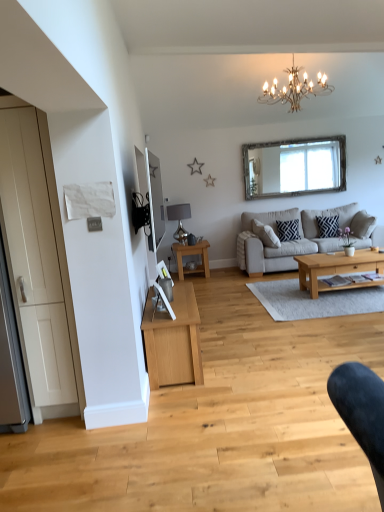
Where is `gold metallic chandelier at upper center`? This screenshot has height=512, width=384. gold metallic chandelier at upper center is located at coordinates (294, 89).

The image size is (384, 512). I want to click on dark blue textured pillow at center right, acting as the 1th pillow starting from the right, so click(328, 226).

Consider the image. In order to face dark blue textured pillow at center right, acting as the 1th pillow starting from the right, should I rotate leftwards or rightwards?

Rotate your view right by about 17.892°.

Measure the distance between point (x=279, y=226) and camera.

Point (x=279, y=226) is 6.81 meters from camera.

The height and width of the screenshot is (512, 384). Describe the element at coordinates (38, 261) in the screenshot. I see `white matte door at left` at that location.

Locate an element on the screen. Image resolution: width=384 pixels, height=512 pixels. matte silver lamp at center-left is located at coordinates (179, 220).

Could you tell me if dark blue textured pillow at center right, which ranks as the second pillow in left-to-right order, is facing white matte door at left?

No, dark blue textured pillow at center right, which ranks as the second pillow in left-to-right order, does not turn towards white matte door at left.

Where is `door above the dark blue textured pillow at center right, acting as the 1th pillow starting from the right (from a real-world perspective)`? door above the dark blue textured pillow at center right, acting as the 1th pillow starting from the right (from a real-world perspective) is located at coordinates (38, 261).

Can you confirm if dark blue textured pillow at center right, acting as the 1th pillow starting from the right, is positioned to the right of white matte door at left?

Indeed, dark blue textured pillow at center right, acting as the 1th pillow starting from the right, is positioned on the right side of white matte door at left.

Is dark blue textured pillow at center right, acting as the 1th pillow starting from the right, wider than white matte door at left?

No.

Is the position of matte black mirror at upper left, which is the 2th mirror in back-to-front order, more distant than that of gold metallic chandelier at upper center?

No, it is in front of gold metallic chandelier at upper center.

The height and width of the screenshot is (512, 384). Find the location of `light fixture behind the matte black mirror at upper left, the first mirror positioned from the left`. light fixture behind the matte black mirror at upper left, the first mirror positioned from the left is located at coordinates (294, 89).

What's the angular difference between matte black mirror at upper left, which is the 2th mirror in back-to-front order, and gold metallic chandelier at upper center's facing directions?

There is a 86.8-degree angle between the facing directions of matte black mirror at upper left, which is the 2th mirror in back-to-front order, and gold metallic chandelier at upper center.

From a real-world perspective, does matte black mirror at upper left, acting as the 2th mirror starting from the right, sit lower than gold metallic chandelier at upper center?

Yes.

Between point (277, 224) and point (273, 83), which one is positioned behind?

Point (277, 224)

Is dark blue geometric-patterned pillow at center, the 1th pillow in the left-to-right sequence, at the right side of gold metallic chandelier at upper center?

Correct, you'll find dark blue geometric-patterned pillow at center, the 1th pillow in the left-to-right sequence, to the right of gold metallic chandelier at upper center.

Considering their positions, is dark blue geometric-patterned pillow at center, the second pillow viewed from the right, located in front of or behind gold metallic chandelier at upper center?

Clearly, dark blue geometric-patterned pillow at center, the second pillow viewed from the right, is behind gold metallic chandelier at upper center.

Is dark blue geometric-patterned pillow at center, the 1th pillow in the left-to-right sequence, aimed at gold metallic chandelier at upper center?

No.

From a real-world perspective, is silver-framed mirror at upper center, the first mirror positioned from the right, below dark blue textured pillow at center right, which ranks as the second pillow in left-to-right order?

No, from a real-world perspective, silver-framed mirror at upper center, the first mirror positioned from the right, is not beneath dark blue textured pillow at center right, which ranks as the second pillow in left-to-right order.

From the image's perspective, which one is positioned lower, silver-framed mirror at upper center, marked as the 1th mirror in a back-to-front arrangement, or dark blue textured pillow at center right, acting as the 1th pillow starting from the right?

From the image's view, dark blue textured pillow at center right, acting as the 1th pillow starting from the right, is below.

Does silver-framed mirror at upper center, which appears as the second mirror when viewed from the front, have a larger size compared to dark blue textured pillow at center right, acting as the 1th pillow starting from the right?

Yes.

Is silver-framed mirror at upper center, the second mirror viewed from the left, smaller than light gray fabric couch at center?

Correct, silver-framed mirror at upper center, the second mirror viewed from the left, occupies less space than light gray fabric couch at center.

Is silver-framed mirror at upper center, the 2th mirror when ordered from bottom to top, facing away from light gray fabric couch at center?

That's not correct — silver-framed mirror at upper center, the 2th mirror when ordered from bottom to top, is not looking away from light gray fabric couch at center.

What's the angular difference between silver-framed mirror at upper center, the first mirror positioned from the right, and light gray fabric couch at center's facing directions?

The facing directions of silver-framed mirror at upper center, the first mirror positioned from the right, and light gray fabric couch at center are 0.168 degrees apart.

Is point (337, 236) closer to viewer compared to point (309, 267)?

No, (337, 236) is behind (309, 267).

Is dark blue textured pillow at center right, acting as the 1th pillow starting from the right, spatially inside light brown wooden coffee table at center, the 2th coffee table viewed from the left, or outside of it?

dark blue textured pillow at center right, acting as the 1th pillow starting from the right, is not enclosed by light brown wooden coffee table at center, the 2th coffee table viewed from the left.

Is dark blue textured pillow at center right, acting as the 1th pillow starting from the right, not close to light brown wooden coffee table at center, which appears as the first coffee table when viewed from the right?

Yes, dark blue textured pillow at center right, acting as the 1th pillow starting from the right, and light brown wooden coffee table at center, which appears as the first coffee table when viewed from the right, are located far from each other.

From the image's perspective, is dark blue textured pillow at center right, acting as the 1th pillow starting from the right, on light brown wooden coffee table at center, arranged as the 2th coffee table when viewed from the back?

Yes, from the image's perspective, dark blue textured pillow at center right, acting as the 1th pillow starting from the right, is above light brown wooden coffee table at center, arranged as the 2th coffee table when viewed from the back.

Is light brown wooden coffee table at center, arranged as the 2th coffee table when viewed from the back, wider than gold metallic chandelier at upper center?

Incorrect, the width of light brown wooden coffee table at center, arranged as the 2th coffee table when viewed from the back, does not surpass that of gold metallic chandelier at upper center.

Can you confirm if light brown wooden coffee table at center, arranged as the 2th coffee table when viewed from the back, is shorter than gold metallic chandelier at upper center?

Indeed, light brown wooden coffee table at center, arranged as the 2th coffee table when viewed from the back, has a lesser height compared to gold metallic chandelier at upper center.

Does light brown wooden coffee table at center, the 2th coffee table viewed from the left, appear on the right side of gold metallic chandelier at upper center?

Yes, light brown wooden coffee table at center, the 2th coffee table viewed from the left, is to the right of gold metallic chandelier at upper center.

Is light brown wooden coffee table at center, which appears as the first coffee table when viewed from the right, aimed at gold metallic chandelier at upper center?

No.

From a real-world perspective, starting from the white matte door at left, which pillow is the 2nd one below it? Please provide its 2D coordinates.

[(328, 226)]

In order to click on mirror on the left side of gold metallic chandelier at upper center in this screenshot , I will do (154, 210).

Considering their positions, is light wood/texture coffee table at center, the first coffee table in the left-to-right sequence, positioned closer to light gray fabric couch at center than gold metallic chandelier at upper center?

light wood/texture coffee table at center, the first coffee table in the left-to-right sequence, is closer to light gray fabric couch at center.

Which object lies nearer to the anchor point matte silver lamp at center-left, dark blue geometric-patterned pillow at center, the second pillow viewed from the right, or light wood/texture coffee table at center, the 2th coffee table in the right-to-left sequence?

Based on the image, light wood/texture coffee table at center, the 2th coffee table in the right-to-left sequence, appears to be nearer to matte silver lamp at center-left.

Which object lies nearer to the anchor point white matte door at left, matte black mirror at upper left, acting as the 2th mirror starting from the right, or gold metallic chandelier at upper center?

The object closer to white matte door at left is matte black mirror at upper left, acting as the 2th mirror starting from the right.

Estimate the real-world distances between objects in this image. Which object is further from dark blue textured pillow at center right, acting as the 1th pillow starting from the right, light gray fabric couch at center or matte silver lamp at center-left?

Based on the image, matte silver lamp at center-left appears to be further to dark blue textured pillow at center right, acting as the 1th pillow starting from the right.

Considering their positions, is light brown wooden coffee table at center, the 2th coffee table viewed from the left, positioned further to white matte door at left than dark blue textured pillow at center right, which ranks as the second pillow in left-to-right order?

dark blue textured pillow at center right, which ranks as the second pillow in left-to-right order, is positioned further to the anchor white matte door at left.

Estimate the real-world distances between objects in this image. Which object is closer to light brown wooden coffee table at center, which ranks as the first coffee table in front-to-back order, gold metallic chandelier at upper center or dark blue textured pillow at center right, acting as the 1th pillow starting from the right?

The object closer to light brown wooden coffee table at center, which ranks as the first coffee table in front-to-back order, is dark blue textured pillow at center right, acting as the 1th pillow starting from the right.

Estimate the real-world distances between objects in this image. Which object is closer to gold metallic chandelier at upper center, silver-framed mirror at upper center, marked as the 1th mirror in a back-to-front arrangement, or light wood/texture coffee table at center, the 2th coffee table in the right-to-left sequence?

The object closer to gold metallic chandelier at upper center is silver-framed mirror at upper center, marked as the 1th mirror in a back-to-front arrangement.

When comparing their distances from light gray fabric couch at center, does light brown wooden coffee table at center, which ranks as the first coffee table in front-to-back order, or dark blue geometric-patterned pillow at center, the 1th pillow in the left-to-right sequence, seem closer?

Based on the image, dark blue geometric-patterned pillow at center, the 1th pillow in the left-to-right sequence, appears to be nearer to light gray fabric couch at center.

I want to click on light fixture positioned between white matte door at left and light wood/texture coffee table at center, the first coffee table in the left-to-right sequence, from near to far, so click(x=294, y=89).

Where is `studio couch located between light wood/texture coffee table at center, which is counted as the first coffee table, starting from the back, and light brown wooden coffee table at center, arranged as the 2th coffee table when viewed from the back, in the left-right direction`? The image size is (384, 512). studio couch located between light wood/texture coffee table at center, which is counted as the first coffee table, starting from the back, and light brown wooden coffee table at center, arranged as the 2th coffee table when viewed from the back, in the left-right direction is located at coordinates (289, 241).

Locate an element on the screen. lamp between gold metallic chandelier at upper center and silver-framed mirror at upper center, the 2th mirror when ordered from bottom to top, from front to back is located at coordinates (179, 220).

At what (x,y) coordinates should I click in order to perform the action: click on studio couch positioned between white matte door at left and light wood/texture coffee table at center, the 2th coffee table when ordered from front to back, from near to far. Please return your answer as a coordinate pair (x, y). This screenshot has height=512, width=384. Looking at the image, I should click on (289, 241).